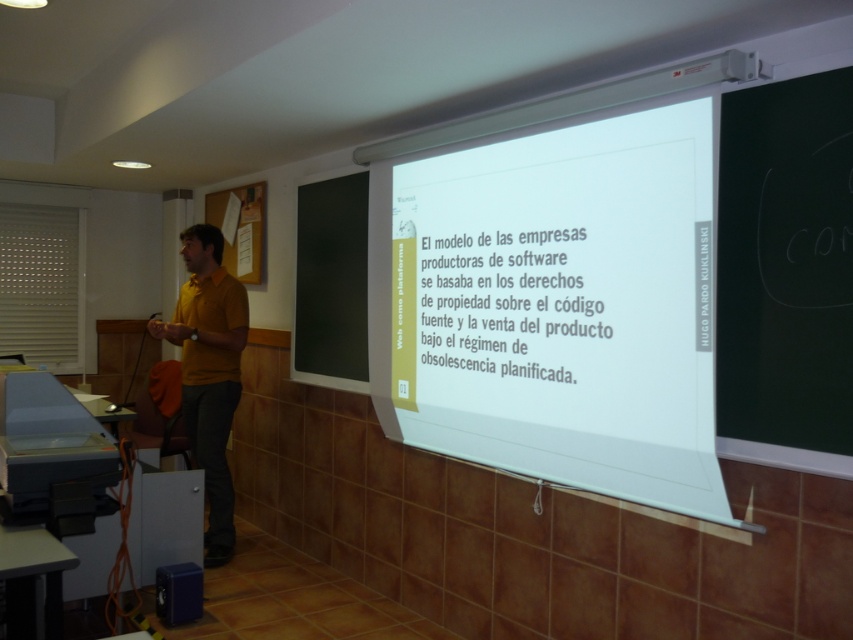
Is black chalkboard at right shorter than white paper at center?

In fact, black chalkboard at right may be taller than white paper at center.

Based on the photo, which is more to the left, black chalkboard at right or white paper at center?

white paper at center

Who is more distant from viewer, (724, 282) or (563, 272)?

Point (563, 272)

Find the location of a particular element. Image resolution: width=853 pixels, height=640 pixels. black chalkboard at right is located at coordinates (785, 269).

Can you confirm if white matte projection screen at center is shorter than yellow matte shirt at left?

Yes, white matte projection screen at center is shorter than yellow matte shirt at left.

Where is `white matte projection screen at center`? white matte projection screen at center is located at coordinates (556, 307).

The image size is (853, 640). What do you see at coordinates (556, 307) in the screenshot? I see `white matte projection screen at center` at bounding box center [556, 307].

Measure the distance between white matte projection screen at center and camera.

white matte projection screen at center and camera are 2.13 meters apart.

Who is more forward, (x=585, y=237) or (x=836, y=294)?

Point (x=836, y=294) is in front.

This screenshot has width=853, height=640. I want to click on white matte projection screen at center, so click(x=556, y=307).